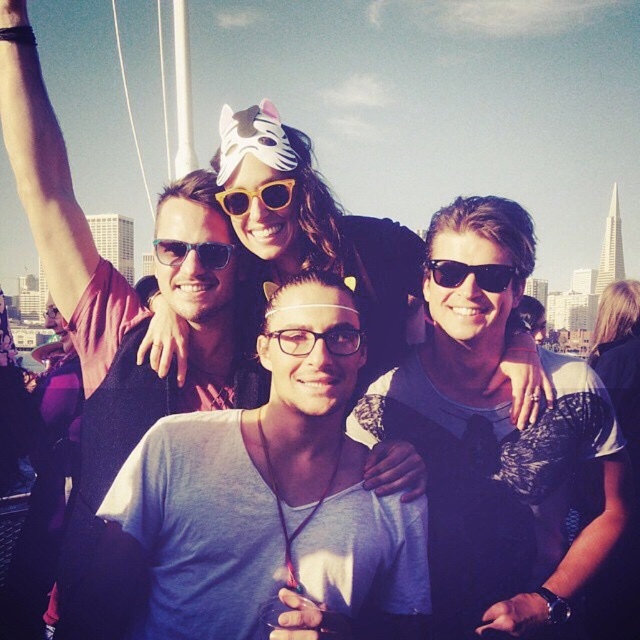
Does transparent plastic glasses at center have a greater width compared to matte plastic sunglasses at center?

Correct, the width of transparent plastic glasses at center exceeds that of matte plastic sunglasses at center.

Does transparent plastic glasses at center have a lesser height compared to matte plastic sunglasses at center?

Yes, transparent plastic glasses at center is shorter than matte plastic sunglasses at center.

Locate an element on the screen. transparent plastic glasses at center is located at coordinates (317, 339).

Locate an element on the screen. The height and width of the screenshot is (640, 640). white paper mask at center is located at coordinates (321, 228).

Is white paper mask at center smaller than matte black sunglasses at center?

No.

The height and width of the screenshot is (640, 640). What do you see at coordinates (321, 228) in the screenshot? I see `white paper mask at center` at bounding box center [321, 228].

Where is `white paper mask at center`? white paper mask at center is located at coordinates (321, 228).

Which is more to the left, gray matte shirt at center or black plastic sunglasses at center?

gray matte shirt at center is more to the left.

Does gray matte shirt at center appear on the right side of black plastic sunglasses at center?

No, gray matte shirt at center is not to the right of black plastic sunglasses at center.

This screenshot has height=640, width=640. I want to click on gray matte shirt at center, so pos(253,522).

You are a GUI agent. You are given a task and a screenshot of the screen. Output one action in this format:
    pyautogui.click(x=<x>, y=<y>)
    Task: Click on the gray matte shirt at center
    This screenshot has height=640, width=640.
    Given the screenshot: What is the action you would take?
    pyautogui.click(x=253, y=522)